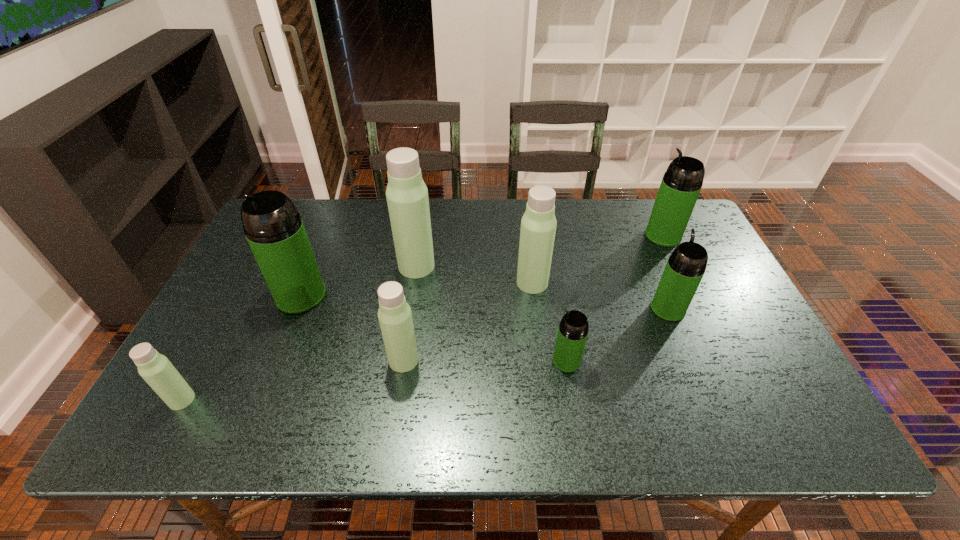
Identify the location of the nearest light thermos bottle. This screenshot has height=540, width=960. (156, 369).

I want to click on the leftmost object, so click(156, 369).

The height and width of the screenshot is (540, 960). Identify the location of free point located 0.330m from the spout of the second object from left to right. (246, 434).

At what (x,y) coordinates should I click in order to perform the action: click on free space located 0.090m on the right of the biggest light thermos bottle. Please return your answer as a coordinate pair (x, y). Looking at the image, I should click on (466, 266).

Locate an element on the screen. This screenshot has height=540, width=960. vacant area situated from the spout of the farthest object is located at coordinates (576, 235).

Identify the location of vacant space situated 0.100m from the spout of the farthest object. (613, 235).

In order to click on vacant space located 0.150m from the spout of the farthest object in this screenshot , I will do `click(598, 235)`.

This screenshot has width=960, height=540. I want to click on free space located 0.280m on the left of the rightmost light thermos bottle, so (417, 283).

What are the coordinates of `vacant space positioned from the spout of the second smallest green thermos bottle` in the screenshot? It's located at (636, 229).

The image size is (960, 540). I want to click on vacant space located from the spout of the second smallest green thermos bottle, so click(x=656, y=279).